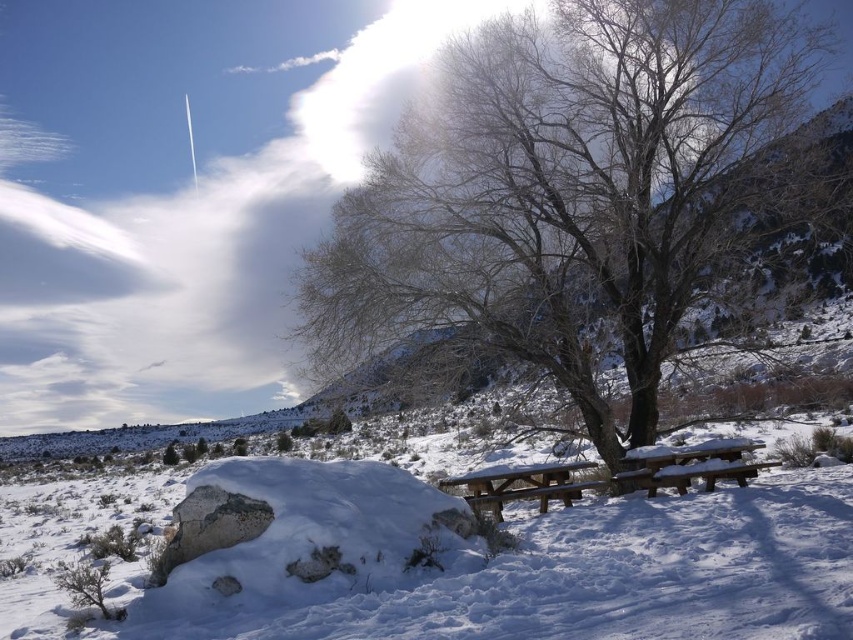
Who is positioned more to the left, snow-covered tree at center or snow-covered wooden picnic table at center?

snow-covered tree at center is more to the left.

Between snow-covered tree at center and snow-covered wooden picnic table at center, which one has less height?

snow-covered wooden picnic table at center

Is point (604, 26) positioned after point (622, 461)?

Yes.

Image resolution: width=853 pixels, height=640 pixels. I want to click on snow-covered tree at center, so click(x=561, y=189).

Which is in front, point (642, 444) or point (572, 465)?

Point (572, 465) is in front.

In the scene shown: Which is below, snow-covered tree at center or brown wooden picnic table at center?

brown wooden picnic table at center is below.

Is point (531, 266) more distant than point (529, 484)?

No, (531, 266) is in front of (529, 484).

Locate an element on the screen. snow-covered tree at center is located at coordinates (561, 189).

Between snow-covered wooden picnic table at center and brown wooden picnic table at center, which one is positioned higher?

snow-covered wooden picnic table at center

How far apart are snow-covered wooden picnic table at center and brown wooden picnic table at center?

They are 16.43 feet apart.

Looking at this image, who is more forward, (759,461) or (486,508)?

Point (486,508) is more forward.

This screenshot has height=640, width=853. I want to click on snow-covered wooden picnic table at center, so click(688, 465).